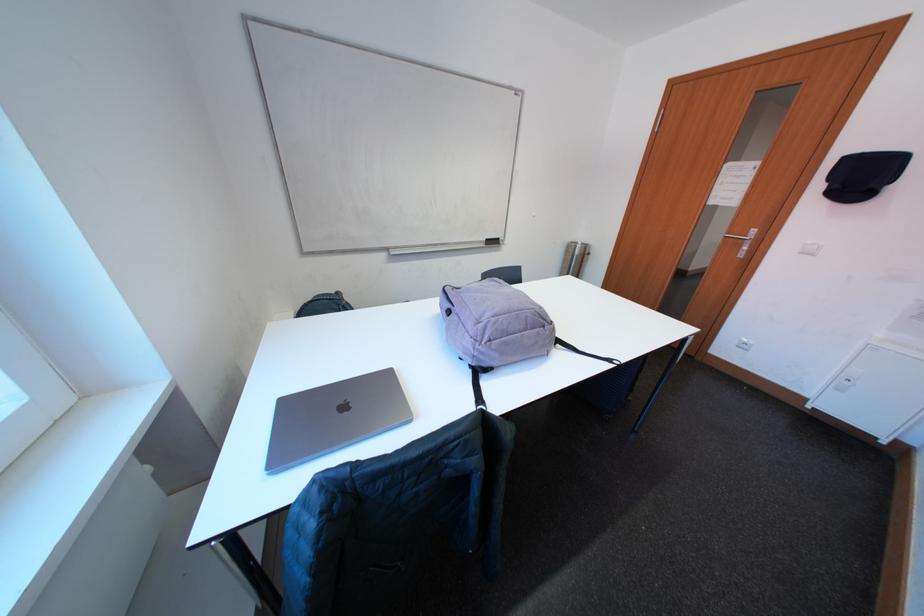
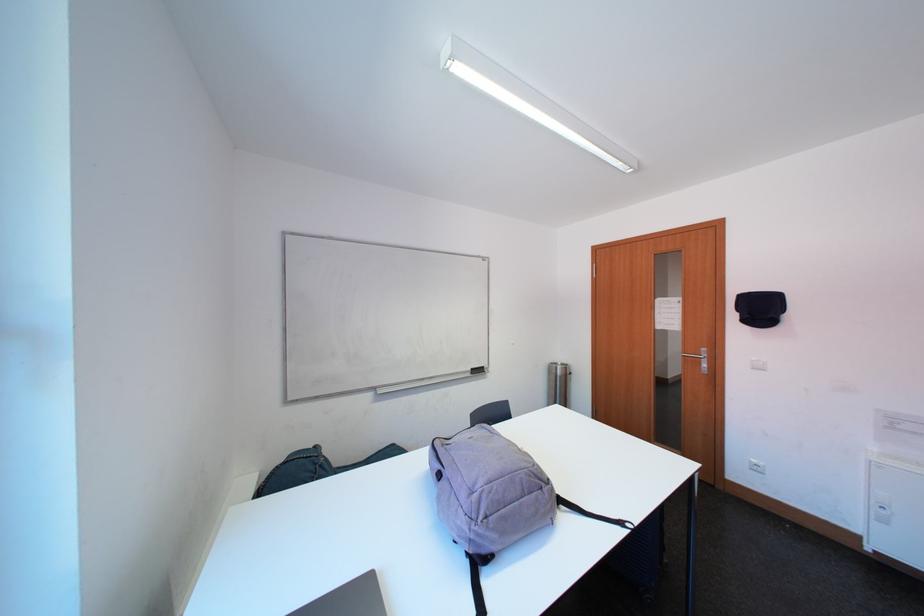
Find the pixel in the second image that matches (739,246) in the first image.

(699, 365)